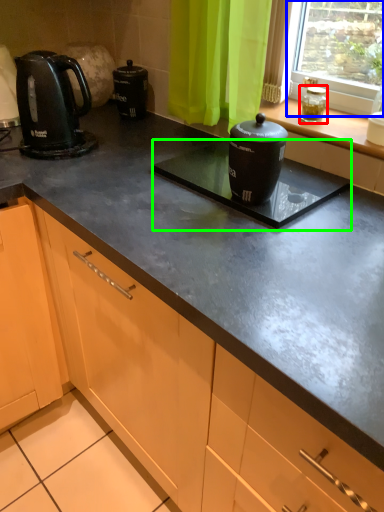
Question: Which is farther away from appliance (highlighted by a red box)? window (highlighted by a blue box) or appliance (highlighted by a green box)?

Choices:
 (A) window
 (B) appliance

Answer: (B)